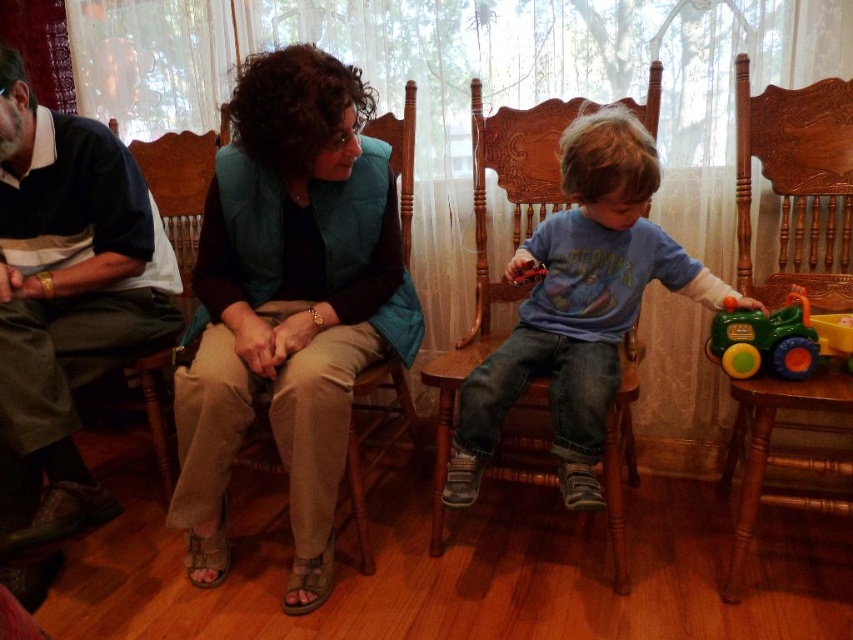
Question: Which of the following is the farthest from the observer?

Choices:
 (A) (196, 212)
 (B) (26, 212)
 (C) (759, 339)

Answer: (A)

Question: In this image, where is dark blue shirt at left located relative to wooden carved rocking chair at right?

Choices:
 (A) below
 (B) above

Answer: (A)

Question: Is teal fabric vest at center to the left of green plastic toy car at lower right from the viewer's perspective?

Choices:
 (A) no
 (B) yes

Answer: (B)

Question: Which point is closer to the camera taking this photo?

Choices:
 (A) (717, 292)
 (B) (782, 324)
 (C) (158, 198)
 (D) (38, 508)

Answer: (B)

Question: Considering the real-world distances, which object is farthest from the brown wood chair at left?

Choices:
 (A) teal fabric vest at center
 (B) blue cotton shirt at center
 (C) wooden carved rocking chair at right

Answer: (C)

Question: Is wooden carved rocking chair at right bigger than green plastic toy car at lower right?

Choices:
 (A) no
 (B) yes

Answer: (B)